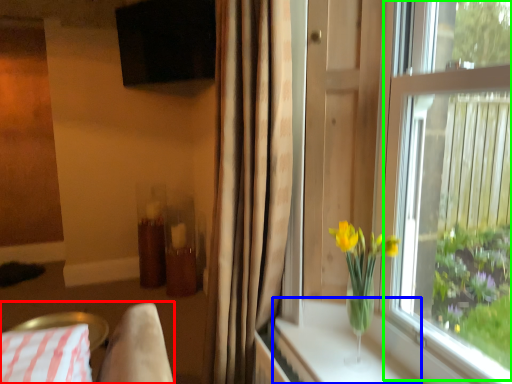
Question: Considering the real-world distances, which object is farthest from bedding (highlighted by a red box)? window sill (highlighted by a blue box) or window screen (highlighted by a green box)?

Choices:
 (A) window sill
 (B) window screen

Answer: (B)